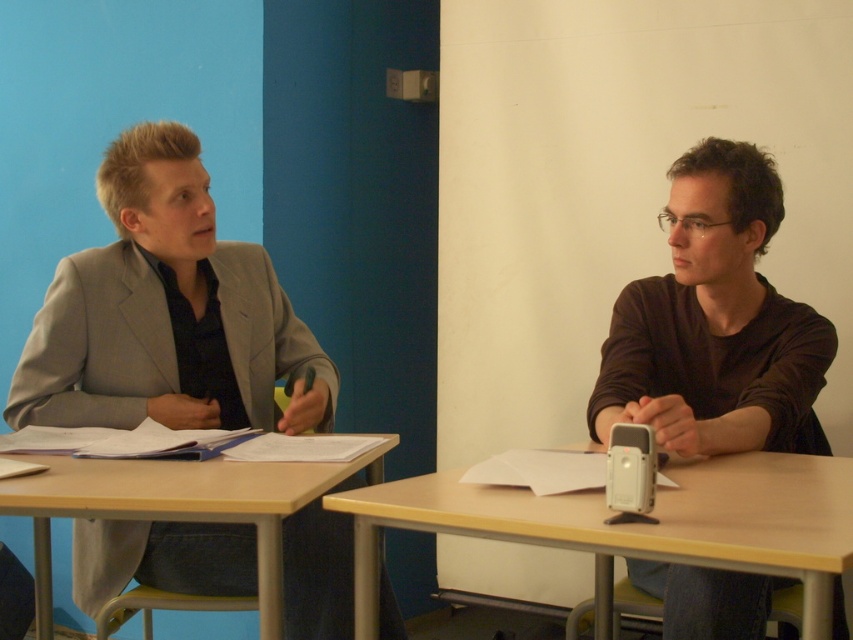
You are organizing a charity clothing drive and need to categorize items by size. You have a matte gray blazer at left and a matte brown shirt at right. Which item should you place in the large size bin?

The matte gray blazer at left should be placed in the large size bin because it has a larger size compared to the matte brown shirt at right.

You are standing in the classroom and want to place a small plant between the matte gray blazer at left and the light brown wood table at lower left. Which object should the plant be closer to in order to be placed at the midpoint between them?

Answer: The matte gray blazer at left is much taller than the light brown wood table at lower left. To place the plant at the midpoint between them, it should be closer to the light brown wood table at lower left because the blazer is taller and thus the midpoint would be nearer to the shorter object.

Please describe the object located at the coordinates point (715, 323) in the image.

The object at point (715, 323) is the matte brown shirt at right.